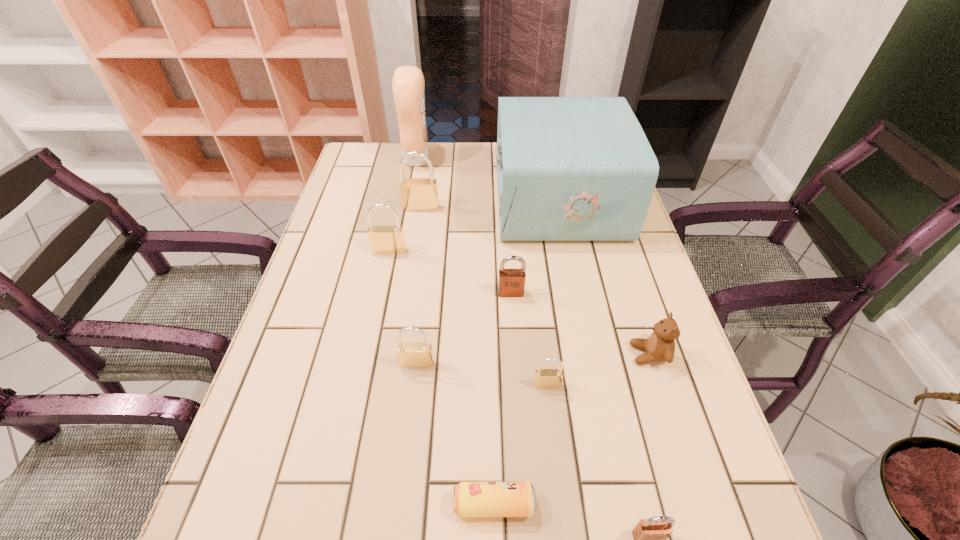
Locate an element on the screen. condiment is located at coordinates (408, 85).

Find the location of a particular element. This screenshot has width=960, height=540. radio receiver is located at coordinates (568, 168).

At what (x,y) coordinates should I click in order to perform the action: click on the farthest padlock. Please return your answer as a coordinate pair (x, y). The width and height of the screenshot is (960, 540). Looking at the image, I should click on (416, 194).

Locate an element on the screen. The image size is (960, 540). the farthest brass padlock is located at coordinates (416, 194).

Image resolution: width=960 pixels, height=540 pixels. In order to click on the second farthest padlock in this screenshot , I will do `click(383, 239)`.

Identify the location of the second farthest brass padlock. Image resolution: width=960 pixels, height=540 pixels. (383, 239).

Find the location of a particular element. This screenshot has width=960, height=540. the bigger brown padlock is located at coordinates (511, 283).

Find the location of a particular element. the third padlock from right to left is located at coordinates (x=511, y=283).

Where is `the fourth farthest padlock`? This screenshot has width=960, height=540. the fourth farthest padlock is located at coordinates (410, 355).

The image size is (960, 540). What are the coordinates of `the second nearest brass padlock` in the screenshot? It's located at (410, 355).